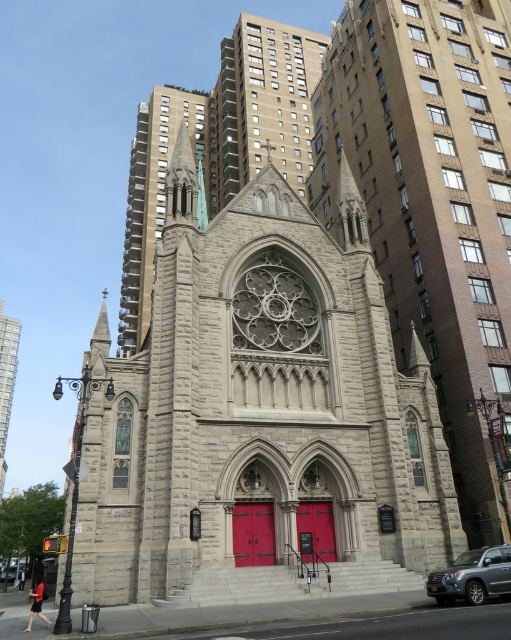
You are standing in front of the historic church and want to enter through the entrance doors. Which object, the gray stone tower at upper center or the matte red door at center, is located higher up relative to you?

The gray stone tower at upper center is located higher up than the matte red door at center.

You are a drone operator who needs to fly a drone from the gray stone spire at center to a nearby building. The drone has a maximum flight range of 150 meters. Can the drone safely reach the building without exceeding its range limit?

The distance between the gray stone spire at center and the nearby building is 160.96 meters, which exceeds the drone operator maximum flight range of 150 meters. The drone cannot safely reach the building without exceeding its range limit.